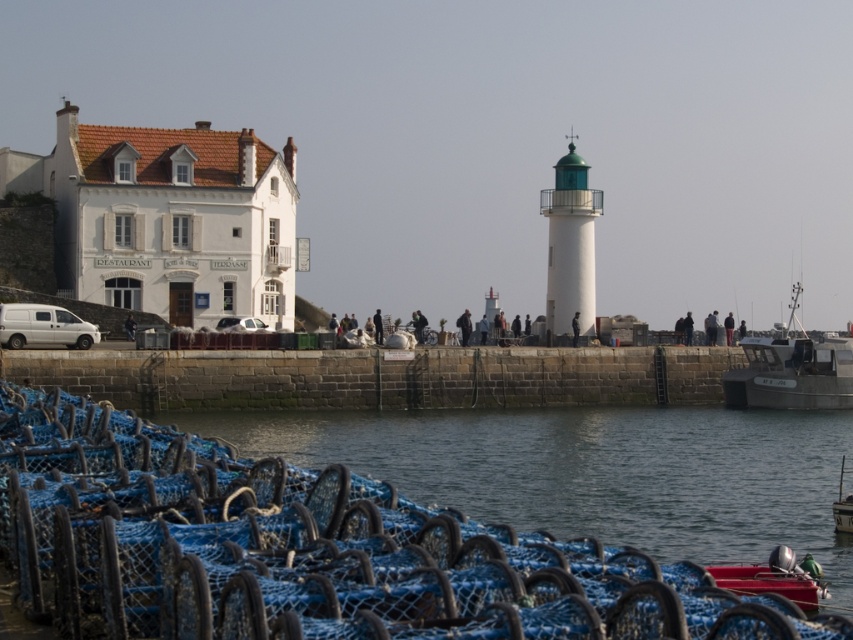
Between white plastic boat at right and metallic silver boat at right, which one appears on the left side from the viewer's perspective?

Positioned to the left is metallic silver boat at right.

Image resolution: width=853 pixels, height=640 pixels. Identify the location of white plastic boat at right. (791, 371).

Between point (512, 481) and point (830, 376), which one is positioned in front?

Point (512, 481) is more forward.

Between blue mesh netting at lower center and white plastic boat at right, which one has more height?

white plastic boat at right

This screenshot has height=640, width=853. What do you see at coordinates (598, 472) in the screenshot? I see `blue mesh netting at lower center` at bounding box center [598, 472].

Where is `blue mesh netting at lower center`? The width and height of the screenshot is (853, 640). blue mesh netting at lower center is located at coordinates click(598, 472).

Between blue mesh netting at lower center and metallic silver boat at right, which one is positioned higher?

blue mesh netting at lower center is higher up.

Can you confirm if blue mesh netting at lower center is positioned above metallic silver boat at right?

Indeed, blue mesh netting at lower center is positioned over metallic silver boat at right.

Who is more distant from viewer, (x=764, y=504) or (x=844, y=513)?

The point (x=764, y=504) is behind.

You are a GUI agent. You are given a task and a screenshot of the screen. Output one action in this format:
    pyautogui.click(x=<x>, y=<y>)
    Task: Click on the blue mesh netting at lower center
    This screenshot has height=640, width=853.
    Given the screenshot: What is the action you would take?
    pyautogui.click(x=598, y=472)